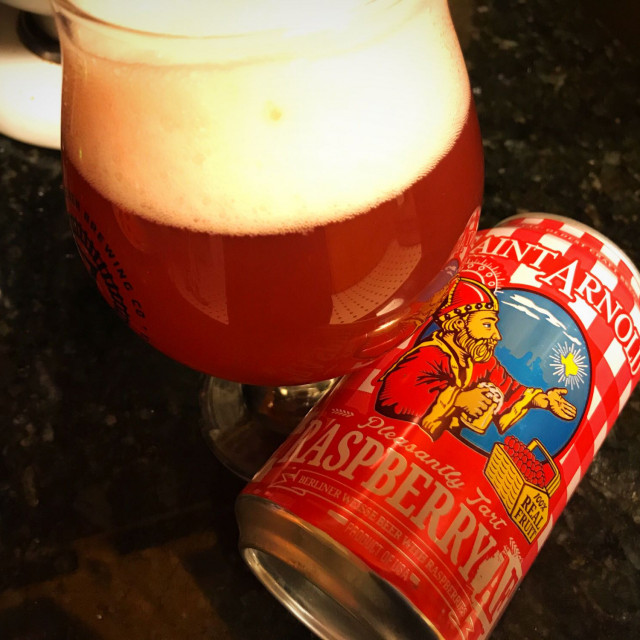
This screenshot has height=640, width=640. In order to click on basket in this screenshot , I will do `click(509, 477)`.